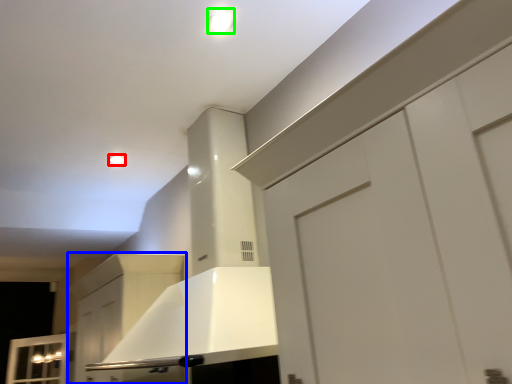
Question: Which is nearer to the lighting (highlighted by a red box)? cabinetry (highlighted by a blue box) or lighting (highlighted by a green box).

Choices:
 (A) cabinetry
 (B) lighting

Answer: (A)